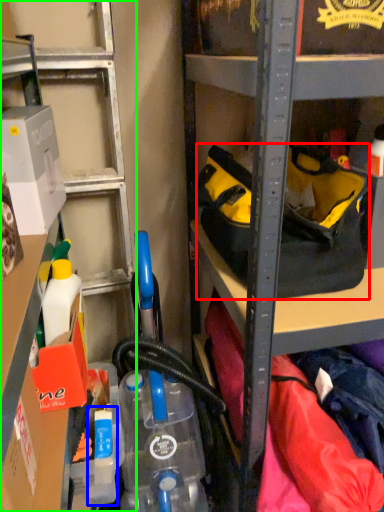
Question: Which object is the closest to the handbag (highlighted by a red box)? Choose among these: bottle (highlighted by a blue box) or shelf (highlighted by a green box).

Choices:
 (A) bottle
 (B) shelf

Answer: (B)